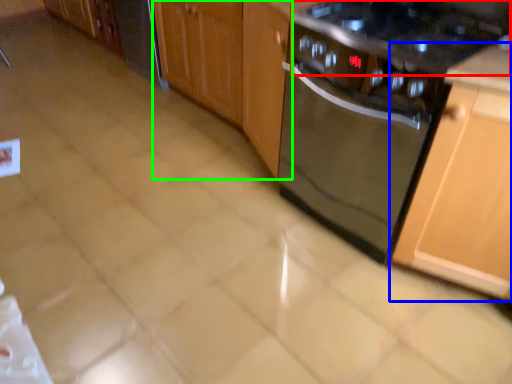
Question: Which is nearer to the gas stove (highlighted by a red box)? cabinetry (highlighted by a blue box) or cabinetry (highlighted by a green box).

Choices:
 (A) cabinetry
 (B) cabinetry

Answer: (A)